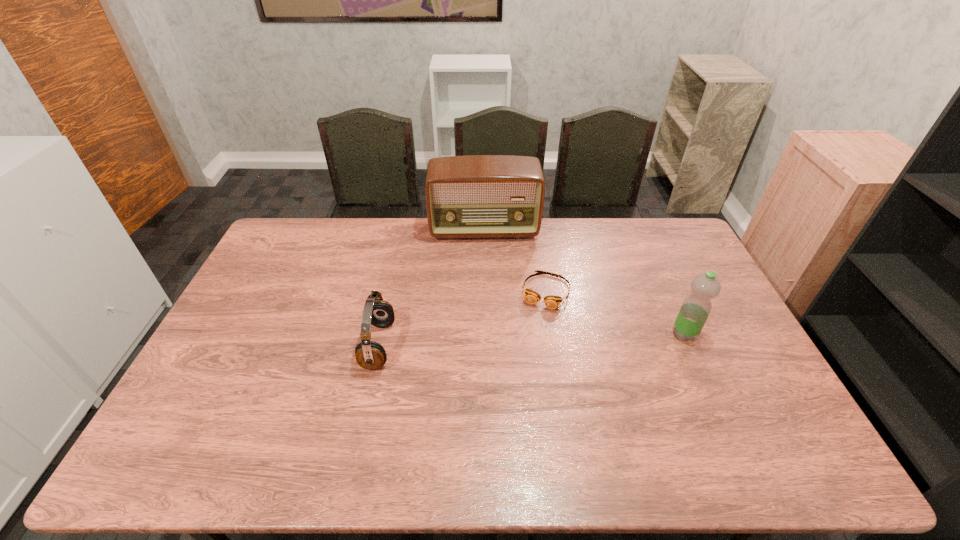
The height and width of the screenshot is (540, 960). I want to click on vacant space on the desktop that is between the leftmost object and the second tallest object and is positioned on the front-facing side of the radio receiver, so click(490, 341).

The image size is (960, 540). Identify the location of free space on the desktop that is between the headset and the second tallest object and is positioned with the lenses facing forward on the shortest object. (529, 340).